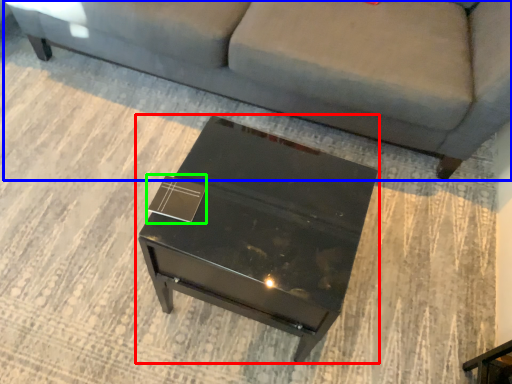
Question: Considering the real-world distances, which object is closest to table (highlighted by a red box)? studio couch (highlighted by a blue box) or square (highlighted by a green box).

Choices:
 (A) studio couch
 (B) square

Answer: (B)